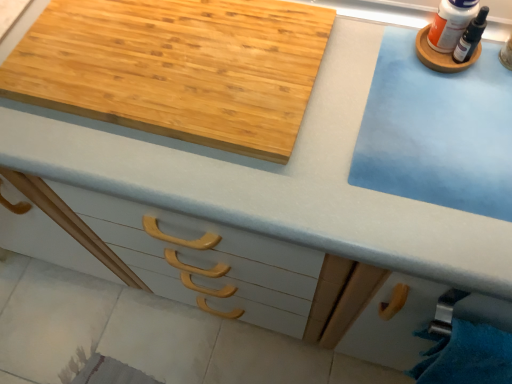
In order to click on blank space situated above natural wood cutting board at upper left (from a real-world perspective) in this screenshot , I will do (169, 52).